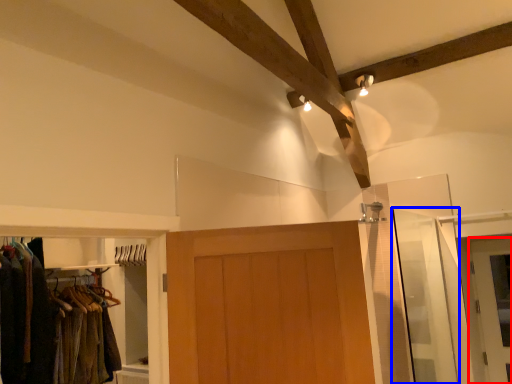
Question: Among these objects, which one is farthest to the camera, door (highlighted by a red box) or screen door (highlighted by a blue box)?

Choices:
 (A) door
 (B) screen door

Answer: (A)